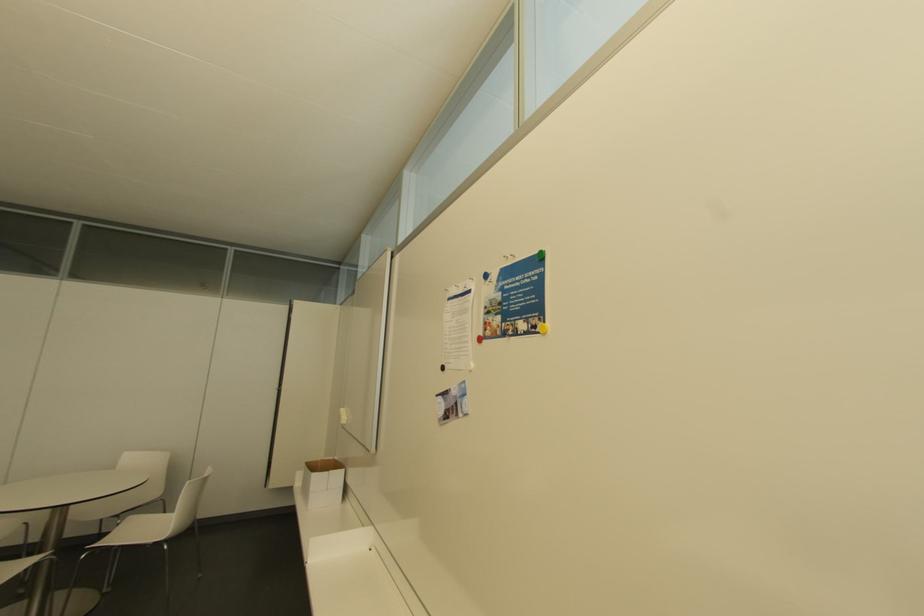
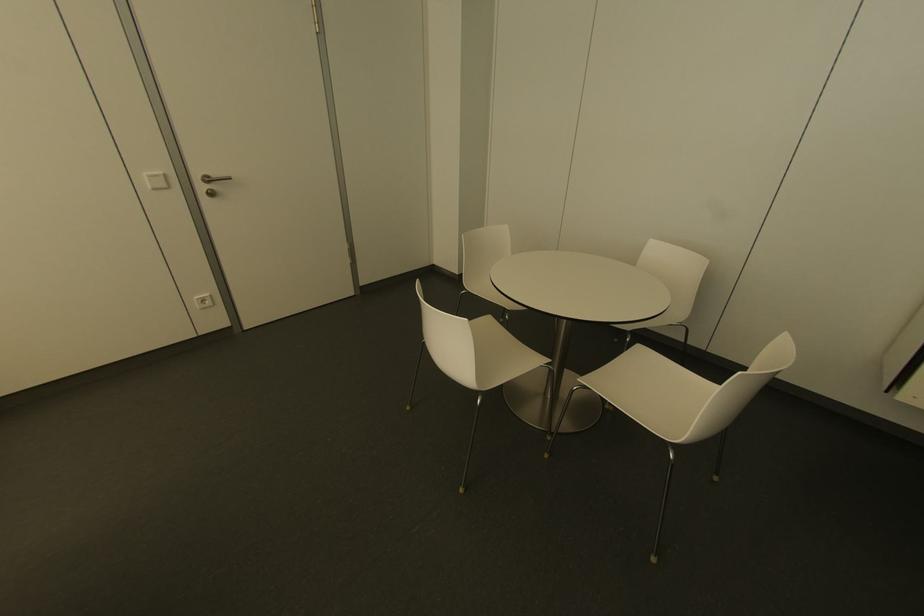
The point at (164, 535) is marked in the first image. Where is the corresponding point in the second image?

(674, 440)